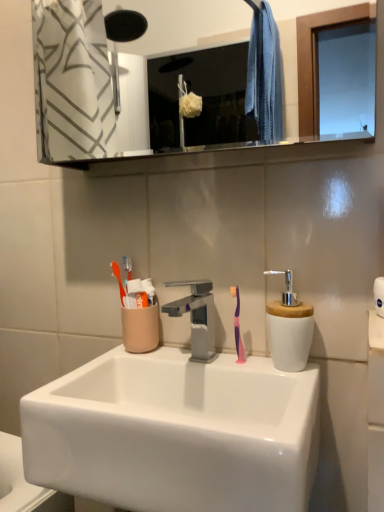
Locate an element on the screen. Image resolution: width=384 pixels, height=512 pixels. free location in front of white ceramic soap dispenser at right is located at coordinates (286, 405).